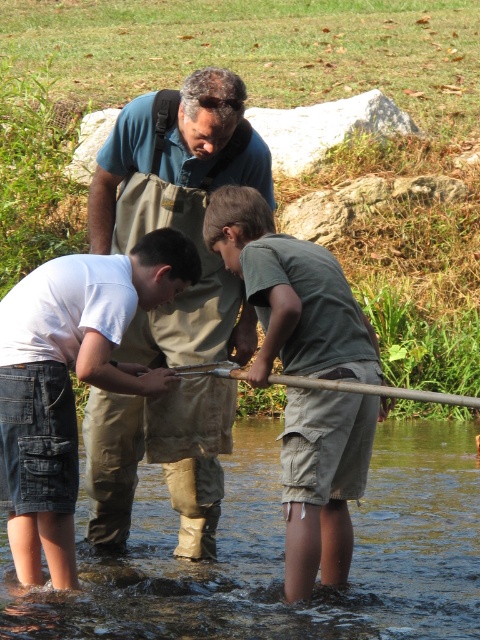
You are a photographer standing at the edge of the stream. You need to capture a photo of the clear water at lower center without getting your camera wet. Since the white cotton shirt at lower left is blocking the view, can you move around to the right side to get a better angle?

The clear water at lower center is positioned under the white cotton shirt at lower left, so moving to the right side might allow you to see around the shirt and capture the water without obstruction.

You are a photographer trying to capture a shot of the clear water at lower center and the green cotton shirt at center. Which object is positioned lower in the image?

The clear water at lower center is positioned lower than the green cotton shirt at center in the image.

You are standing at the origin point of the coordinate system in this image. You need to locate the clear water at lower center. What are its coordinates?

The clear water at lower center is located at coordinates point (283,554).